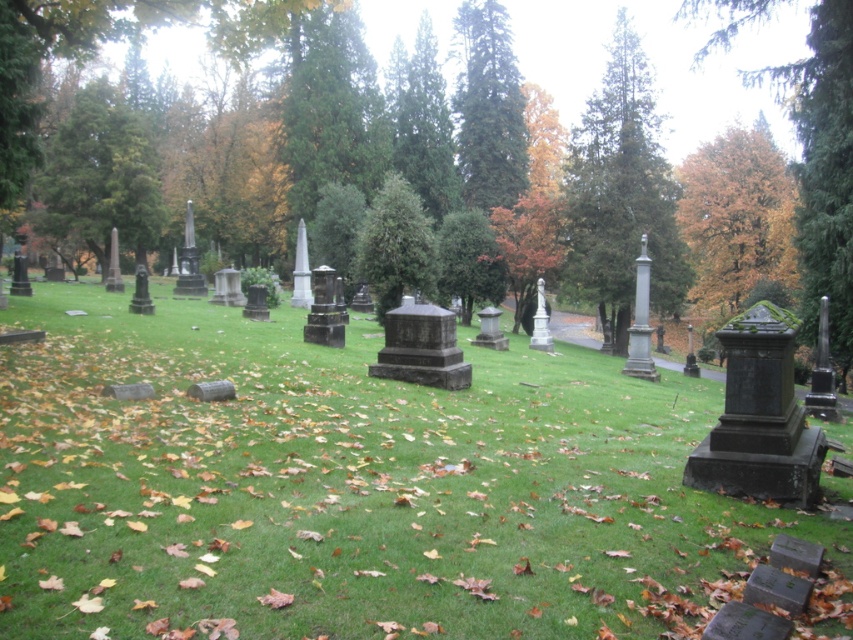
You are a landscape architect designing a walking path between the green textured tree at upper left and the green matte tree at center. What is the minimum length the path must be to connect them directly?

The minimum length the path must be to connect the green textured tree at upper left and the green matte tree at center directly is 24.18 meters, as that is the distance between them.

You are standing at the edge of a cemetery and see the green grassy at center and the orange matte tree at center. Which object is positioned lower in the image?

The green grassy at center is located below the orange matte tree at center, so it is positioned lower in the image.